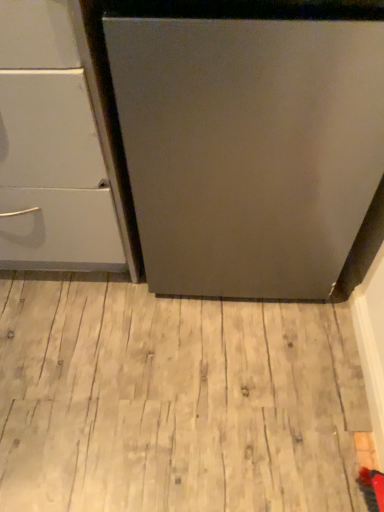
Question: From the image's perspective, relative to white glossy drawer at left, is light wood flooring at center above or below?

Choices:
 (A) above
 (B) below

Answer: (B)

Question: From a real-world perspective, relative to white glossy drawer at left, is light wood flooring at center vertically above or below?

Choices:
 (A) above
 (B) below

Answer: (B)

Question: Is light wood flooring at center situated inside white glossy drawer at left or outside?

Choices:
 (A) inside
 (B) outside

Answer: (B)

Question: Is point (38, 215) positioned closer to the camera than point (24, 494)?

Choices:
 (A) closer
 (B) farther

Answer: (B)

Question: Looking at the image, does white glossy drawer at left seem bigger or smaller compared to light wood flooring at center?

Choices:
 (A) small
 (B) big

Answer: (B)

Question: Considering their positions, is white glossy drawer at left located in front of or behind light wood flooring at center?

Choices:
 (A) behind
 (B) front

Answer: (B)

Question: Is white glossy drawer at left taller or shorter than light wood flooring at center?

Choices:
 (A) short
 (B) tall

Answer: (B)